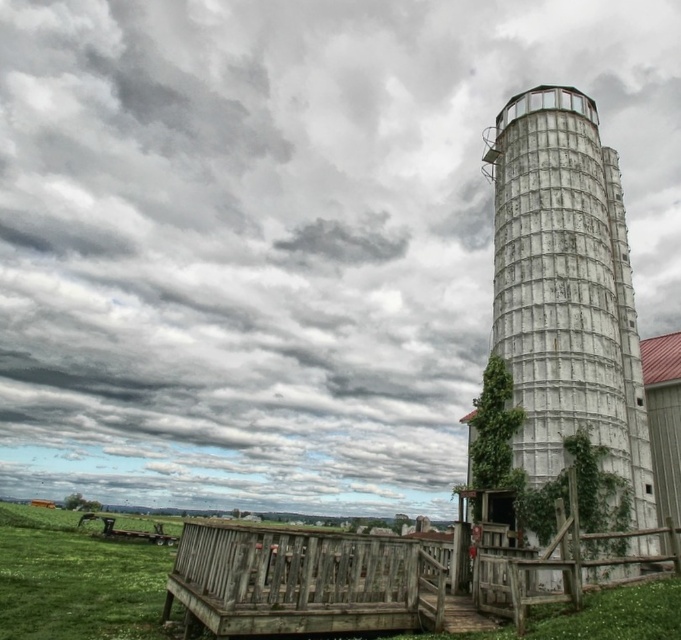
You are a painter hired to paint both the white weathered metal silo at right and the weathered wood fence at lower center. You have a ladder that can reach up to 2 meters. Considering their heights, which object will require you to use the ladder?

The white weathered metal silo at right is not as tall as the weathered wood fence at lower center, so the fence will require the ladder since it is taller than the silo and the ladder can reach up to 2 meters.

Consider the image. You are a painter who needs to decide which object to paint first. The white weathered metal silo at right and the weathered wood fence at lower center are both in need of a fresh coat. Considering their sizes, which object requires more paint?

The weathered wood fence at lower center requires more paint because it is larger than the white weathered metal silo at right.

You are standing at the base of the silo and looking towards the observation deck. There are two points marked on the silo structure. One is at coordinate point (633, 428) and the other is at point (270, 586). Which point is closer to your current position?

Point (633, 428) is further to the camera than point (270, 586), so the point closer to your current position is point (270, 586).